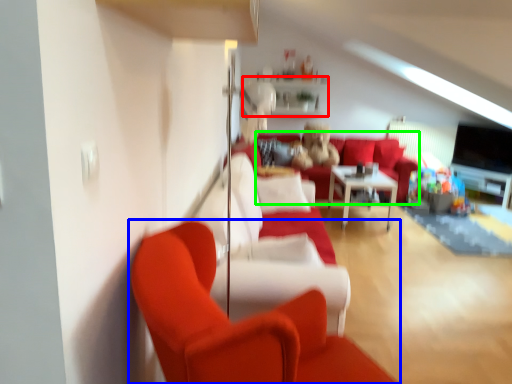
Question: Estimate the real-world distances between objects in this image. Which object is farther from shelf (highlighted by a red box), studio couch (highlighted by a blue box) or couch (highlighted by a green box)?

Choices:
 (A) studio couch
 (B) couch

Answer: (A)